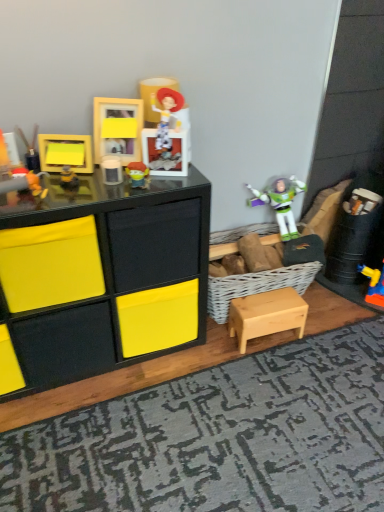
Question: Can you confirm if matte black frame at upper left, the first toy when ordered from left to right, is taller than matte plastic buzz lightyear at center, which appears as the sixth toy when viewed from the left?

Choices:
 (A) yes
 (B) no

Answer: (A)

Question: Is matte black frame at upper left, the 6th toy in the right-to-left sequence, to the left of matte plastic buzz lightyear at center, which appears as the sixth toy when viewed from the left, from the viewer's perspective?

Choices:
 (A) no
 (B) yes

Answer: (B)

Question: Is matte plastic buzz lightyear at center, arranged as the first toy when viewed from the right, surrounded by matte black frame at upper left, the 6th toy in the right-to-left sequence?

Choices:
 (A) no
 (B) yes

Answer: (A)

Question: Does matte black frame at upper left, the first toy when ordered from left to right, have a smaller size compared to matte plastic buzz lightyear at center, arranged as the first toy when viewed from the right?

Choices:
 (A) no
 (B) yes

Answer: (A)

Question: From the image's perspective, would you say matte black frame at upper left, the first toy when ordered from left to right, is positioned over matte plastic buzz lightyear at center, arranged as the first toy when viewed from the right?

Choices:
 (A) yes
 (B) no

Answer: (A)

Question: Could you tell me if matte black frame at upper left, the first toy when ordered from left to right, is turned towards matte plastic buzz lightyear at center, which appears as the sixth toy when viewed from the left?

Choices:
 (A) yes
 (B) no

Answer: (B)

Question: Is matte yellow frame at upper left, which appears as the fourth toy when viewed from the left, taller than matte yellow frame at upper center, which appears as the second toy when viewed from the right?

Choices:
 (A) yes
 (B) no

Answer: (B)

Question: Is matte yellow frame at upper center, which appears as the second toy when viewed from the right, inside matte yellow frame at upper left, which appears as the fourth toy when viewed from the left?

Choices:
 (A) yes
 (B) no

Answer: (B)

Question: Is matte yellow frame at upper left, which appears as the fourth toy when viewed from the left, looking in the opposite direction of matte yellow frame at upper center, which is counted as the fifth toy, starting from the left?

Choices:
 (A) no
 (B) yes

Answer: (A)

Question: Is matte yellow frame at upper left, which appears as the fourth toy when viewed from the left, next to matte yellow frame at upper center, which is counted as the fifth toy, starting from the left, and touching it?

Choices:
 (A) no
 (B) yes

Answer: (A)

Question: Does matte yellow frame at upper left, which appears as the fourth toy when viewed from the left, have a smaller size compared to matte yellow frame at upper center, which is counted as the fifth toy, starting from the left?

Choices:
 (A) no
 (B) yes

Answer: (B)

Question: From a real-world perspective, is matte yellow frame at upper left, which ranks as the 3th toy in right-to-left order, on top of matte yellow frame at upper center, which is counted as the fifth toy, starting from the left?

Choices:
 (A) yes
 (B) no

Answer: (B)

Question: Considering the relative positions of matte yellow frame at upper center, which appears as the second toy when viewed from the right, and matte black frame at upper left, the first toy when ordered from left to right, in the image provided, is matte yellow frame at upper center, which appears as the second toy when viewed from the right, to the left of matte black frame at upper left, the first toy when ordered from left to right, from the viewer's perspective?

Choices:
 (A) yes
 (B) no

Answer: (B)